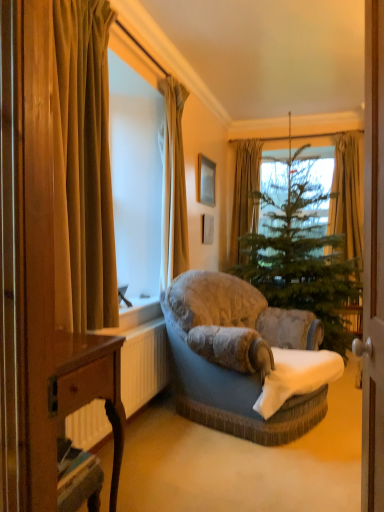
Question: From the image's perspective, relative to wooden desk at lower left, is green fabric curtain at upper center, the third curtain positioned from the left, above or below?

Choices:
 (A) below
 (B) above

Answer: (B)

Question: Is green fabric curtain at upper center, the 4th curtain positioned from the front, spatially inside wooden desk at lower left, or outside of it?

Choices:
 (A) outside
 (B) inside

Answer: (A)

Question: Based on their relative distances, which object is nearer to the wooden picture frame at upper center?

Choices:
 (A) white plastic radiator at lower left
 (B) wooden desk at lower left
 (C) green fabric curtain at upper right, placed as the 3th curtain when sorted from front to back
 (D) green textured christmas tree at center
 (E) velvet grey couch at center

Answer: (D)

Question: Which is nearer to the velvet grey couch at center?

Choices:
 (A) green textured christmas tree at center
 (B) wooden picture frame at upper center
 (C) green fabric curtain at upper right, which is the first curtain from right to left
 (D) velvet gold curtain at left, which is counted as the first curtain, starting from the front
 (E) silky beige curtain at upper center, marked as the third curtain in a right-to-left arrangement

Answer: (E)